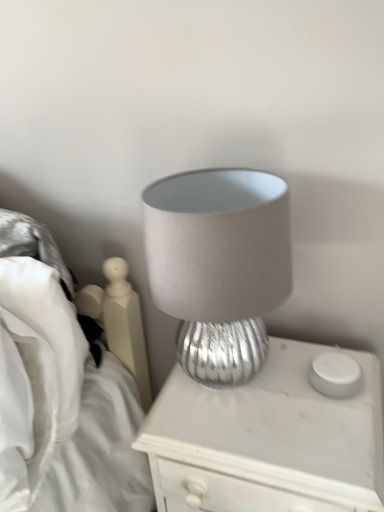
Question: Is white matte candle holder at right looking in the opposite direction of silver textured lamp at center?

Choices:
 (A) no
 (B) yes

Answer: (A)

Question: Is white matte candle holder at right smaller than silver textured lamp at center?

Choices:
 (A) no
 (B) yes

Answer: (B)

Question: From the image's perspective, does white matte candle holder at right appear lower than silver textured lamp at center?

Choices:
 (A) yes
 (B) no

Answer: (B)

Question: From a real-world perspective, is white matte candle holder at right physically above silver textured lamp at center?

Choices:
 (A) no
 (B) yes

Answer: (B)

Question: From the image's perspective, is white matte candle holder at right on silver textured lamp at center?

Choices:
 (A) yes
 (B) no

Answer: (A)

Question: In terms of height, does white matte candle holder at right look taller or shorter compared to satin gray lampshade at center?

Choices:
 (A) short
 (B) tall

Answer: (A)

Question: Based on their positions, is white matte candle holder at right located to the left or right of satin gray lampshade at center?

Choices:
 (A) left
 (B) right

Answer: (B)

Question: Is white matte candle holder at right in front of or behind satin gray lampshade at center in the image?

Choices:
 (A) front
 (B) behind

Answer: (B)

Question: Considering the positions of white matte candle holder at right and satin gray lampshade at center in the image, is white matte candle holder at right bigger or smaller than satin gray lampshade at center?

Choices:
 (A) small
 (B) big

Answer: (A)

Question: From the image's perspective, is silver textured lamp at center positioned above or below satin gray lampshade at center?

Choices:
 (A) above
 (B) below

Answer: (B)

Question: Is silver textured lamp at center in front of or behind satin gray lampshade at center in the image?

Choices:
 (A) front
 (B) behind

Answer: (B)

Question: Would you say silver textured lamp at center is to the left or to the right of satin gray lampshade at center in the picture?

Choices:
 (A) right
 (B) left

Answer: (A)

Question: From their relative heights in the image, would you say silver textured lamp at center is taller or shorter than satin gray lampshade at center?

Choices:
 (A) tall
 (B) short

Answer: (A)

Question: From a real-world perspective, relative to white matte candle holder at right, is satin gray lampshade at center vertically above or below?

Choices:
 (A) below
 (B) above

Answer: (B)

Question: Is satin gray lampshade at center wider or thinner than white matte candle holder at right?

Choices:
 (A) thin
 (B) wide

Answer: (B)